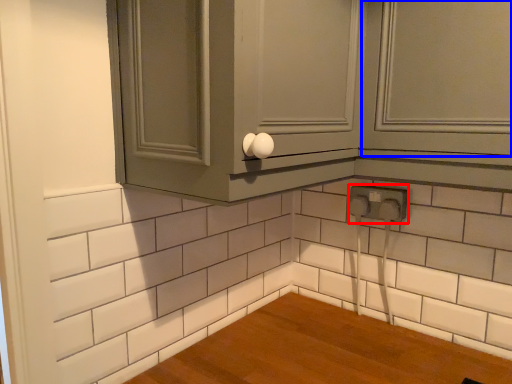
Question: Which object appears farthest to the camera in this image, electric outlet (highlighted by a red box) or window (highlighted by a blue box)?

Choices:
 (A) electric outlet
 (B) window

Answer: (A)